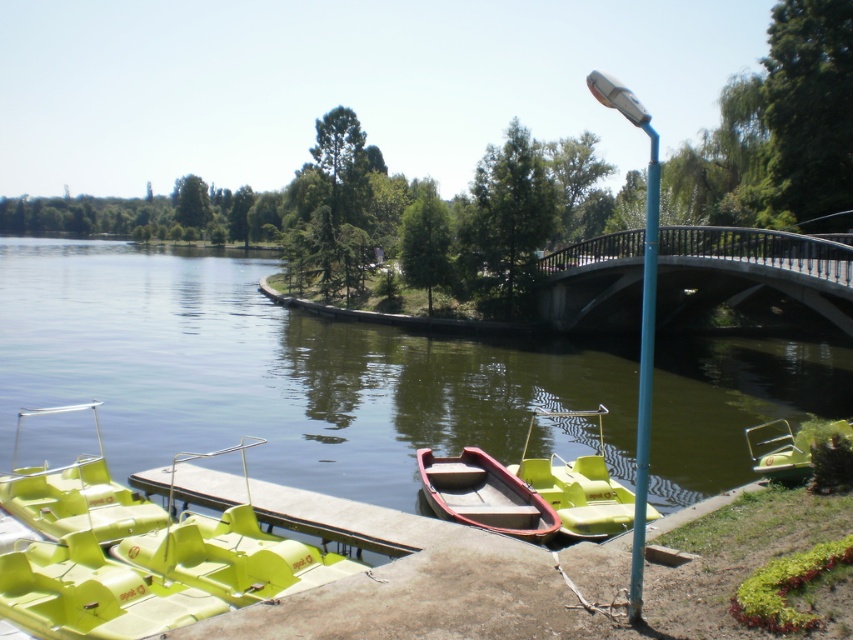
What do you see at coordinates (273, 371) in the screenshot? The height and width of the screenshot is (640, 853). I see `green plastic boats at lower left` at bounding box center [273, 371].

Between green plastic boats at lower left and gray concrete bridge at center, which one is positioned lower?

gray concrete bridge at center is below.

Identify the location of green plastic boats at lower left. (273, 371).

Image resolution: width=853 pixels, height=640 pixels. What are the coordinates of `green plastic boats at lower left` in the screenshot? It's located at (273, 371).

Can you confirm if green plastic boats at lower left is positioned to the right of matte green paddle boat at center?

No, green plastic boats at lower left is not to the right of matte green paddle boat at center.

Looking at this image, is green plastic boats at lower left closer to camera compared to matte green paddle boat at center?

No, green plastic boats at lower left is behind matte green paddle boat at center.

Find the location of a particular element. Image resolution: width=853 pixels, height=640 pixels. green plastic boats at lower left is located at coordinates (273, 371).

Which of these two, matte green plastic paddle boat at lower left or wooden canoe at center, stands taller?

With more height is wooden canoe at center.

Is point (258, 572) farther from viewer compared to point (527, 504)?

That is False.

The height and width of the screenshot is (640, 853). Describe the element at coordinates (135, 554) in the screenshot. I see `matte green plastic paddle boat at lower left` at that location.

Locate an element on the screen. matte green plastic paddle boat at lower left is located at coordinates (135, 554).